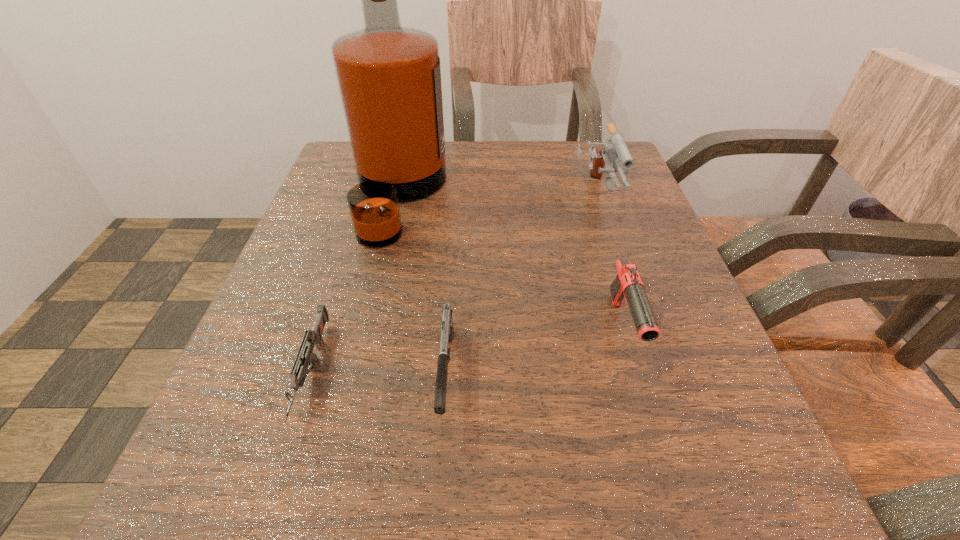
You are a GUI agent. You are given a task and a screenshot of the screen. Output one action in this format:
    pyautogui.click(x=<x>, y=<y>)
    Task: Click on the free spot at the near edge of the desktop
    
    Given the screenshot: What is the action you would take?
    pyautogui.click(x=449, y=512)

Find the location of `free location at the left edge of the desktop`. free location at the left edge of the desktop is located at coordinates (306, 233).

Find the location of a particular element. Image resolution: width=960 pixels, height=540 pixels. free space at the right edge is located at coordinates (708, 342).

At what (x,y) coordinates should I click in order to perform the action: click on vacant space at the near right corner of the desktop. Please return your answer as a coordinate pair (x, y). Looking at the image, I should click on (781, 532).

At what (x,y) coordinates should I click in order to perform the action: click on free space between the third shortest gun and the tallest object. Please return your answer as a coordinate pair (x, y). This screenshot has width=960, height=540. Looking at the image, I should click on (512, 262).

Locate an element on the screen. The image size is (960, 540). free space between the third object from left to right and the tallest gun is located at coordinates (521, 285).

The width and height of the screenshot is (960, 540). I want to click on free spot between the tallest object and the third tallest object, so click(512, 262).

Identify the location of empty space between the third gun from right to left and the liquor. The height and width of the screenshot is (540, 960). (422, 286).

In order to click on free space between the shortest object and the third tallest gun in this screenshot , I will do `click(379, 373)`.

This screenshot has width=960, height=540. I want to click on vacant space in between the leftmost gun and the farthest gun, so click(x=454, y=285).